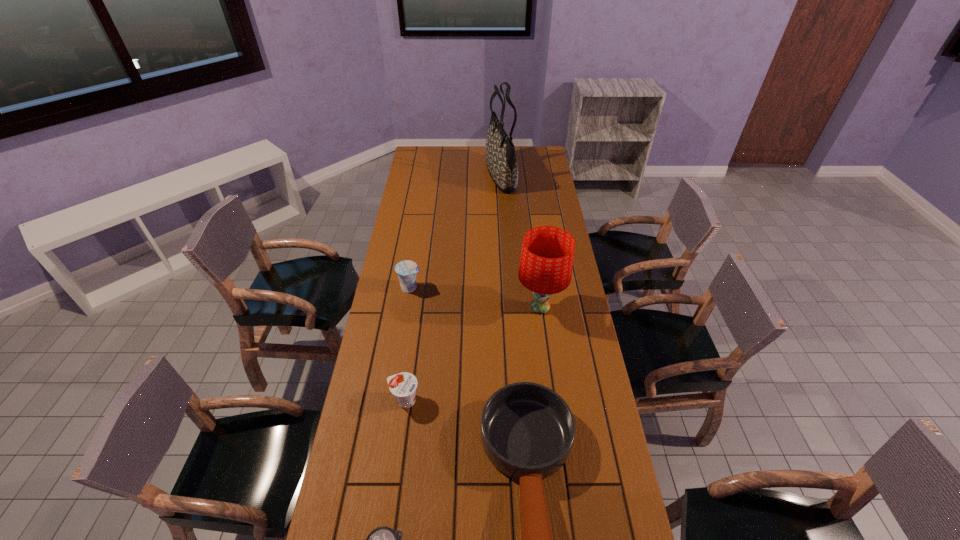
I want to click on free spot located on the right of the second nearest yogurt, so (x=479, y=400).

This screenshot has height=540, width=960. Find the location of `object present at the far edge`. object present at the far edge is located at coordinates (500, 155).

The height and width of the screenshot is (540, 960). I want to click on object that is at the right edge, so click(x=546, y=262).

What are the coordinates of `vacant space at the left edge of the desktop` in the screenshot? It's located at (x=402, y=368).

Find the location of a particular element. vacant space at the right edge is located at coordinates click(x=564, y=326).

Find the location of `vacant area at the far left corner of the desktop`. vacant area at the far left corner of the desktop is located at coordinates (415, 160).

Image resolution: width=960 pixels, height=540 pixels. I want to click on vacant area between the fifth shortest object and the farthest object, so click(520, 241).

Where is `empty location between the tallest object and the tallest yogurt`? empty location between the tallest object and the tallest yogurt is located at coordinates (456, 231).

Find the location of a particular element. vacant area that lies between the second nearest yogurt and the farthest yogurt is located at coordinates (408, 344).

At what (x,y) coordinates should I click in order to perform the action: click on vacant space that is in between the second farthest yogurt and the lampshade. Please return your answer as a coordinate pair (x, y). The image size is (960, 540). Looking at the image, I should click on [x=472, y=354].